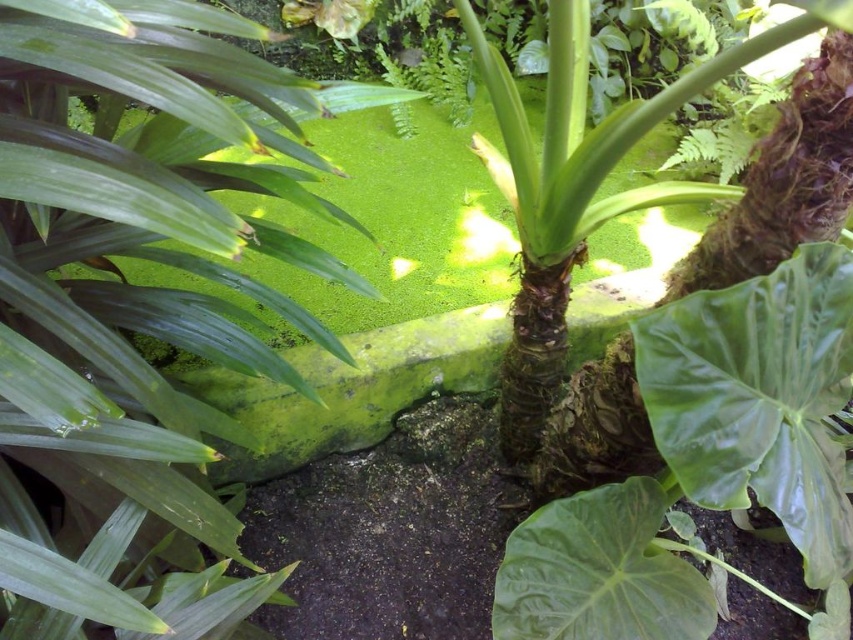
You are a gardener who wants to place a small decorative stone between the green glossy leaf at center and the green matte leaf at center. The stone is 1 inch in diameter. Is there enough space between them to fit the stone?

The green glossy leaf at center is 10.95 inches away from the green matte leaf at center. Since the stone is only 1 inch in diameter, there is ample space between them to fit the stone comfortably.

You are a gardener who wants to identify which leaf is bigger between the green glossy leaf at center and the green matte leaf at center. Which one is bigger?

The green glossy leaf at center is larger in size than the green matte leaf at center.